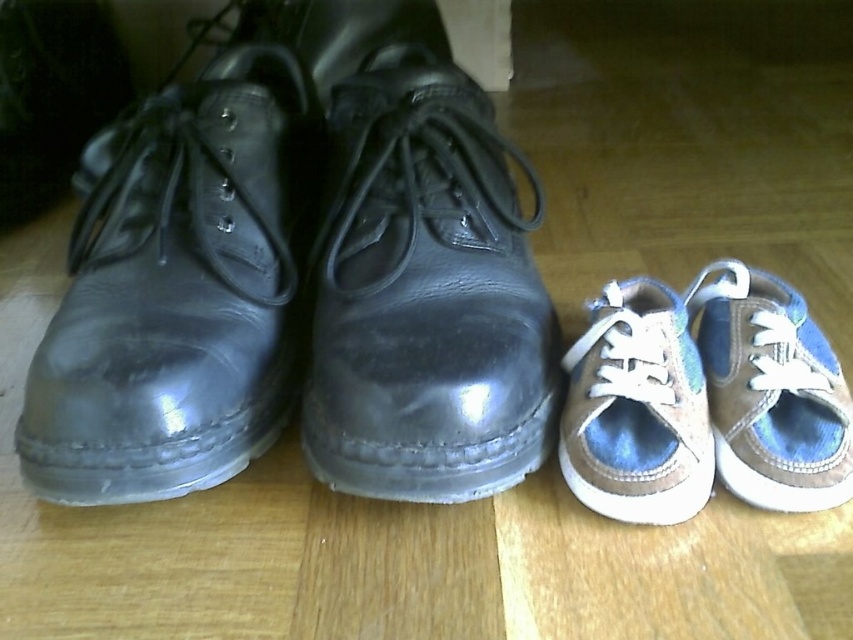
Which of these two, shiny black leather dress shoe at left or glossy leather shoe at center, stands taller?

glossy leather shoe at center

Does shiny black leather dress shoe at left appear on the right side of glossy leather shoe at center?

No, shiny black leather dress shoe at left is not to the right of glossy leather shoe at center.

What do you see at coordinates (177, 289) in the screenshot? This screenshot has height=640, width=853. I see `shiny black leather dress shoe at left` at bounding box center [177, 289].

Where is `shiny black leather dress shoe at left`? shiny black leather dress shoe at left is located at coordinates (177, 289).

Is glossy leather shoe at center shorter than denim fabric sneakers at right?

Incorrect, glossy leather shoe at center's height does not fall short of denim fabric sneakers at right's.

Is glossy leather shoe at center thinner than denim fabric sneakers at right?

Incorrect, glossy leather shoe at center's width is not less than denim fabric sneakers at right's.

Locate an element on the screen. glossy leather shoe at center is located at coordinates (425, 294).

Looking at this image, can you confirm if glossy leather shoe at center is positioned above tan suede sneaker at lower right?

Correct, glossy leather shoe at center is located above tan suede sneaker at lower right.

Find the location of `glossy leather shoe at center`. glossy leather shoe at center is located at coordinates (425, 294).

You are a GUI agent. You are given a task and a screenshot of the screen. Output one action in this format:
    pyautogui.click(x=<x>, y=<y>)
    Task: Click on the glossy leather shoe at center
    The width and height of the screenshot is (853, 640).
    Given the screenshot: What is the action you would take?
    pyautogui.click(x=425, y=294)